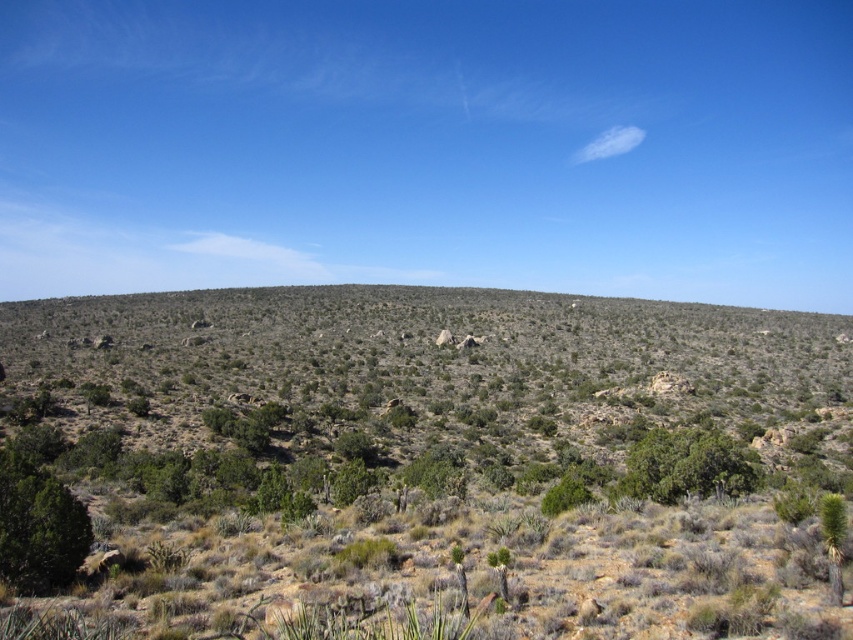
Question: Observing the image, what is the correct spatial positioning of green shrubs at center in reference to green leafy shrub at lower right?

Choices:
 (A) right
 (B) left

Answer: (A)

Question: Which object appears closest to the camera in this image?

Choices:
 (A) green shrubs at center
 (B) green leafy plant at lower right

Answer: (A)

Question: Does green leafy shrub at lower right appear on the right side of green leafy plant at lower right?

Choices:
 (A) yes
 (B) no

Answer: (A)

Question: Based on their relative distances, which object is farther from the green leafy bush at center?

Choices:
 (A) green matte tree at lower left
 (B) green leafy shrub at lower right
 (C) green leafy plant at lower right

Answer: (C)

Question: Which of the following is the farthest from the observer?

Choices:
 (A) (57, 515)
 (B) (833, 550)

Answer: (A)

Question: Does green matte tree at lower left have a larger size compared to green leafy plant at lower right?

Choices:
 (A) no
 (B) yes

Answer: (A)